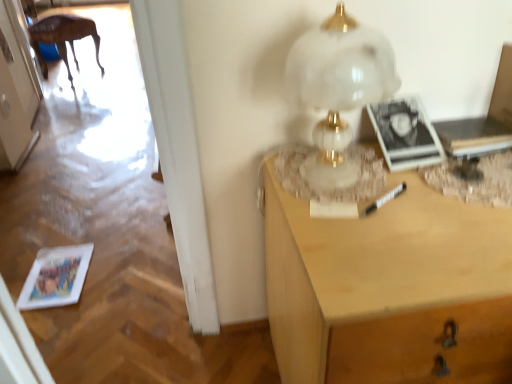
This screenshot has height=384, width=512. Identify the location of vacant area that is in front of white marble table lamp at upper right. (368, 234).